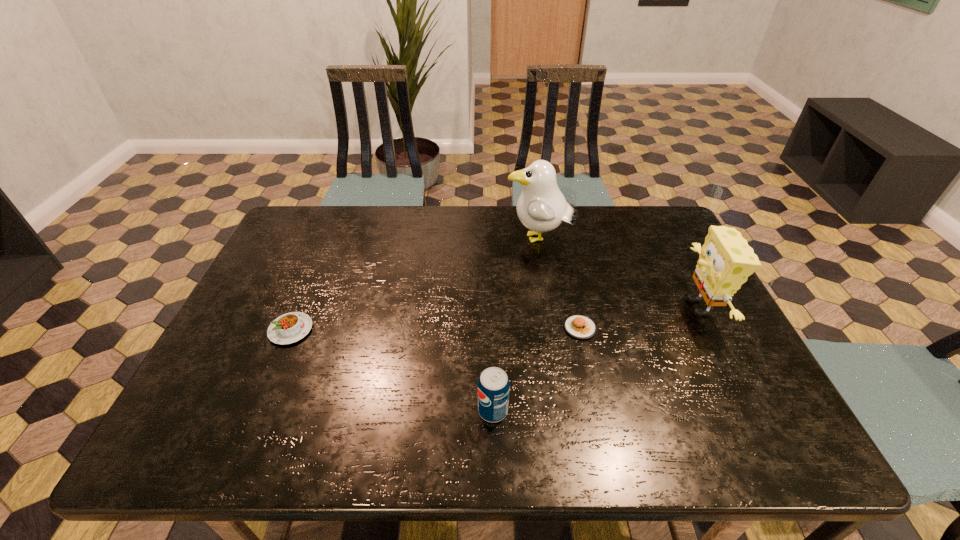
Find the location of a particular element. object located in the left edge section of the desktop is located at coordinates (291, 327).

Image resolution: width=960 pixels, height=540 pixels. I want to click on object that is at the right edge, so click(726, 260).

In the image, there is a desktop. Identify the location of vacant space at the far edge. (x=492, y=218).

I want to click on free space at the near edge of the desktop, so click(x=386, y=422).

Locate an element on the screen. free space at the left edge of the desktop is located at coordinates (252, 307).

In the image, there is a desktop. Where is `vacant area at the right edge`? vacant area at the right edge is located at coordinates pyautogui.click(x=683, y=274).

Find the location of a particular element. Image resolution: width=960 pixels, height=540 pixels. free space at the far right corner of the desktop is located at coordinates (639, 233).

You are a GUI agent. You are given a task and a screenshot of the screen. Output one action in this format:
    pyautogui.click(x=<x>, y=<y>)
    Task: Click on the vacant area that lies between the fourth object from right to left and the gull
    The height and width of the screenshot is (540, 960).
    Given the screenshot: What is the action you would take?
    pyautogui.click(x=516, y=325)

This screenshot has width=960, height=540. I want to click on vacant region between the farthest object and the pudding, so click(415, 285).

Locate an element on the screen. The height and width of the screenshot is (540, 960). free point between the food and the second tallest object is located at coordinates (639, 318).